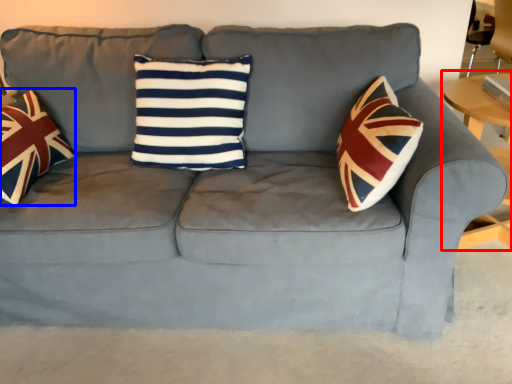
Question: Among these objects, which one is nearest to the camera, table (highlighted by a red box) or throw pillow (highlighted by a blue box)?

Choices:
 (A) table
 (B) throw pillow

Answer: (B)